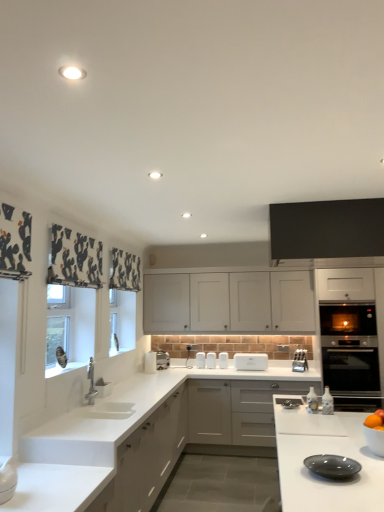
Question: Is white matte cabinet at center, the 1th cabinetry when ordered from bottom to top, bigger than white glossy paper towel dispenser at upper center, the 1th appliance positioned from the left?

Choices:
 (A) yes
 (B) no

Answer: (A)

Question: From a real-world perspective, is white matte cabinet at center, marked as the third cabinetry in a top-to-bottom arrangement, below white glossy paper towel dispenser at upper center, the 1th appliance positioned from the left?

Choices:
 (A) no
 (B) yes

Answer: (B)

Question: Could you tell me if white matte cabinet at center, the 2th cabinetry when ordered from front to back, is turned towards white glossy paper towel dispenser at upper center, the 2th appliance positioned from the right?

Choices:
 (A) no
 (B) yes

Answer: (A)

Question: Is white matte cabinet at center, marked as the third cabinetry in a top-to-bottom arrangement, positioned with its back to white glossy paper towel dispenser at upper center, the 2th appliance positioned from the right?

Choices:
 (A) yes
 (B) no

Answer: (B)

Question: Is white matte cabinet at center, the 1th cabinetry when ordered from bottom to top, surrounding white glossy paper towel dispenser at upper center, the 2th appliance positioned from the right?

Choices:
 (A) yes
 (B) no

Answer: (B)

Question: Is white matte cabinet at center, the 1th cabinetry when ordered from bottom to top, positioned beyond the bounds of white glossy paper towel dispenser at upper center, the 2th appliance positioned from the right?

Choices:
 (A) no
 (B) yes

Answer: (B)

Question: Considering the relative sizes of black glass oven at right, acting as the first oven starting from the top, and black matte cabinet at upper center, which appears as the 1th cabinetry when viewed from the front, in the image provided, is black glass oven at right, acting as the first oven starting from the top, bigger than black matte cabinet at upper center, which appears as the 1th cabinetry when viewed from the front,?

Choices:
 (A) no
 (B) yes

Answer: (B)

Question: Is black glass oven at right, the 2th oven ordered from the bottom, next to black matte cabinet at upper center, which is the third cabinetry from back to front?

Choices:
 (A) yes
 (B) no

Answer: (B)

Question: Can you confirm if black glass oven at right, the 2th oven ordered from the bottom, is taller than black matte cabinet at upper center, which ranks as the first cabinetry in top-to-bottom order?

Choices:
 (A) no
 (B) yes

Answer: (B)

Question: Is black glass oven at right, acting as the first oven starting from the top, looking in the opposite direction of black matte cabinet at upper center, which appears as the 1th cabinetry when viewed from the front?

Choices:
 (A) yes
 (B) no

Answer: (B)

Question: Is black glass oven at right, the 2th oven ordered from the bottom, aimed at black matte cabinet at upper center, which appears as the 1th cabinetry when viewed from the front?

Choices:
 (A) no
 (B) yes

Answer: (B)

Question: Considering the relative sizes of black glass oven at right, acting as the first oven starting from the top, and black matte cabinet at upper center, which ranks as the first cabinetry in top-to-bottom order, in the image provided, is black glass oven at right, acting as the first oven starting from the top, shorter than black matte cabinet at upper center, which ranks as the first cabinetry in top-to-bottom order,?

Choices:
 (A) yes
 (B) no

Answer: (B)

Question: Is white matte cabinet at center, marked as the third cabinetry in a top-to-bottom arrangement, to the right of black glass oven at right, the 2th oven ordered from the bottom, from the viewer's perspective?

Choices:
 (A) yes
 (B) no

Answer: (B)